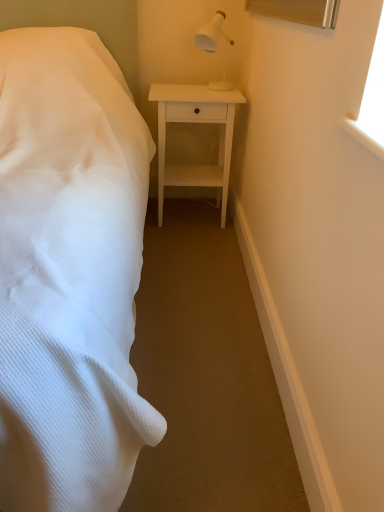
Question: From a real-world perspective, is white textured bed at left above or below white matte nightstand at center?

Choices:
 (A) below
 (B) above

Answer: (B)

Question: From the image's perspective, is white textured bed at left positioned above or below white matte nightstand at center?

Choices:
 (A) below
 (B) above

Answer: (A)

Question: Which object is positioned closest to the white plastic lamp at upper right?

Choices:
 (A) white matte nightstand at center
 (B) white textured bed at left

Answer: (A)

Question: Which of these objects is positioned farthest from the white textured bed at left?

Choices:
 (A) white plastic lamp at upper right
 (B) white matte nightstand at center

Answer: (A)